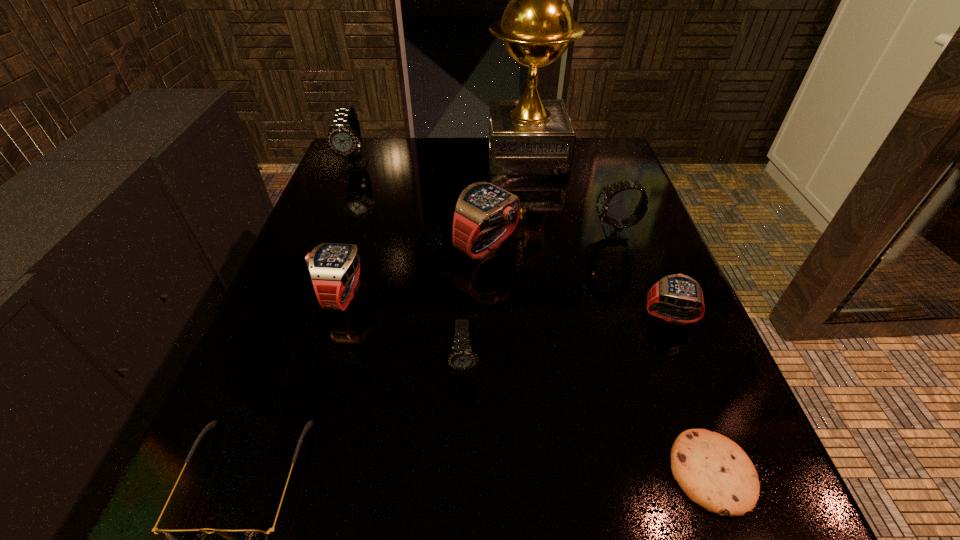
Identify the location of vacant space situated on the face of the rightmost gray watch. (564, 233).

Find the location of a particular element. The image size is (960, 540). free space located on the face of the rightmost gray watch is located at coordinates (479, 233).

This screenshot has width=960, height=540. Identify the location of blank space located 0.170m on the back of the leftmost red watch. (366, 219).

Identify the location of free spot located 0.160m on the face of the third nearest object. (461, 496).

Locate an element on the screen. The image size is (960, 540). vacant space situated on the left of the shortest watch is located at coordinates (424, 315).

In order to click on vacant space located 0.200m on the back of the shortest object in this screenshot , I will do `click(656, 322)`.

This screenshot has height=540, width=960. Find the location of `award located at the far edge`. award located at the far edge is located at coordinates (529, 136).

The height and width of the screenshot is (540, 960). I want to click on watch present at the far edge, so click(x=344, y=137).

This screenshot has height=540, width=960. Identify the location of object present at the near edge. (714, 472).

At what (x,y) coordinates should I click in order to perform the action: click on award located in the right edge section of the desktop. Please return your answer as a coordinate pair (x, y). Looking at the image, I should click on (529, 136).